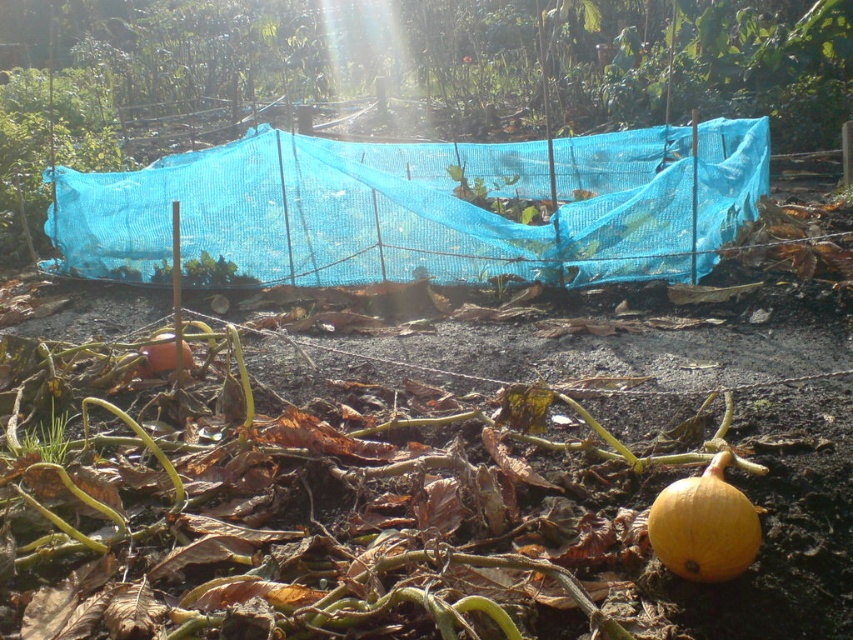
Question: Estimate the real-world distances between objects in this image. Which object is closer to the blue mesh net at center?

Choices:
 (A) orange matte pumpkin at lower right
 (B) orange matte pumpkin at lower left

Answer: (B)

Question: Can you confirm if orange matte pumpkin at lower right is thinner than orange matte pumpkin at lower left?

Choices:
 (A) yes
 (B) no

Answer: (A)

Question: Which object appears farthest from the camera in this image?

Choices:
 (A) orange matte pumpkin at lower left
 (B) blue mesh net at center

Answer: (B)

Question: Does orange matte pumpkin at lower right appear on the right side of orange matte pumpkin at lower left?

Choices:
 (A) yes
 (B) no

Answer: (A)

Question: Is blue mesh net at center above orange matte pumpkin at lower left?

Choices:
 (A) no
 (B) yes

Answer: (B)

Question: Which of the following is the farthest from the observer?

Choices:
 (A) blue mesh net at center
 (B) orange matte pumpkin at lower left
 (C) orange matte pumpkin at lower right

Answer: (A)